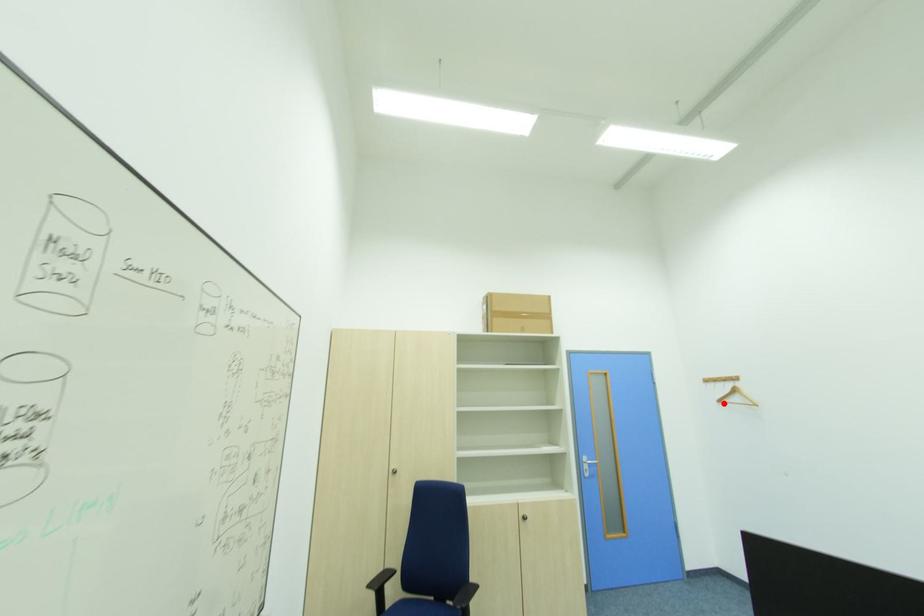
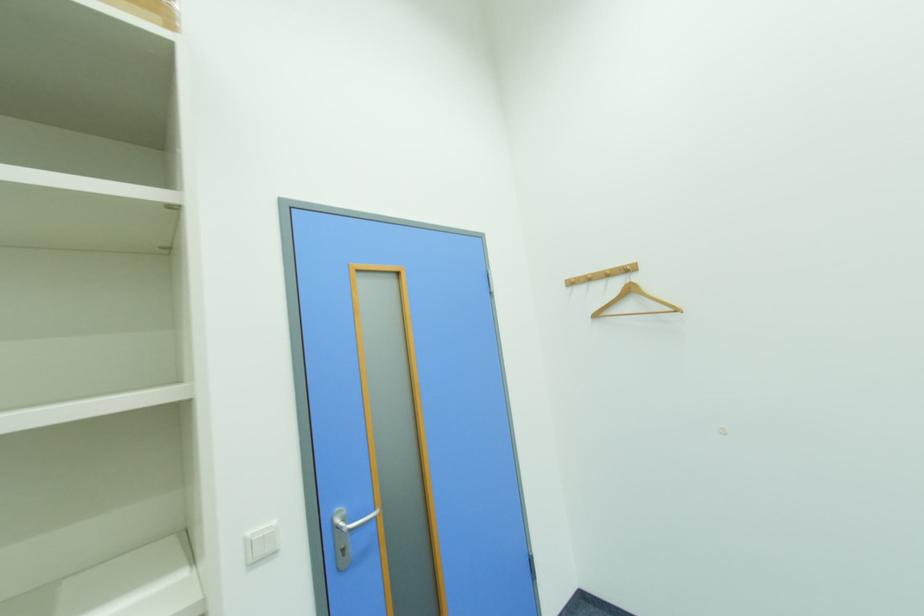
Locate, in the second image, the point that corresponds to the highlighted location in the first image.

(601, 317)